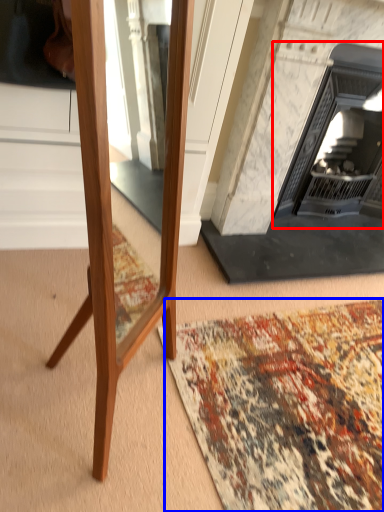
Question: Which object appears farthest to the camera in this image, fireplace (highlighted by a red box) or mat (highlighted by a blue box)?

Choices:
 (A) fireplace
 (B) mat

Answer: (A)